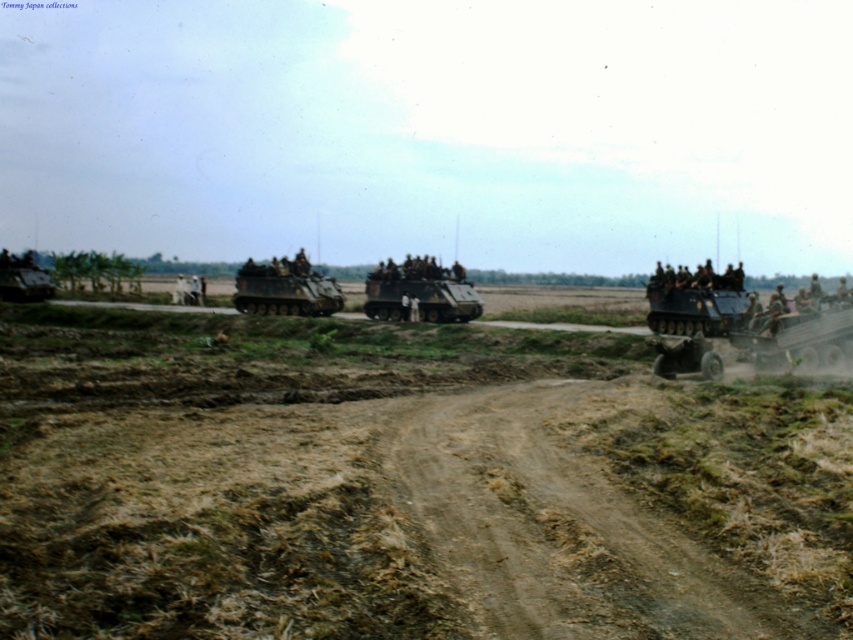
Looking at this image, is matte black armored personnel carrier at right above matte green tank at lower left?

Incorrect, matte black armored personnel carrier at right is not positioned above matte green tank at lower left.

Which of these two, matte black armored personnel carrier at right or matte green tank at lower left, stands taller?

matte black armored personnel carrier at right is taller.

Is point (706, 284) positioned in front of point (53, 282)?

Yes, it is.

Find the location of a particular element. Image resolution: width=853 pixels, height=640 pixels. matte black armored personnel carrier at right is located at coordinates (695, 300).

Is matte black armored personnel carrier at center below matte green tank at center?

Correct, matte black armored personnel carrier at center is located below matte green tank at center.

Does point (422, 292) lie in front of point (337, 285)?

Yes, point (422, 292) is closer to viewer.

Which is behind, point (392, 296) or point (341, 300)?

Positioned behind is point (341, 300).

This screenshot has height=640, width=853. I want to click on matte black armored personnel carrier at center, so click(421, 291).

From the picture: Which of these two, matte black armored personnel carrier at center or matte green tank at lower left, stands taller?

matte green tank at lower left

Which of these two, matte black armored personnel carrier at center or matte green tank at lower left, stands shorter?

matte black armored personnel carrier at center is shorter.

Who is more forward, [425,282] or [21,285]?

Point [425,282] is in front.

Image resolution: width=853 pixels, height=640 pixels. Find the location of `matte black armored personnel carrier at center`. matte black armored personnel carrier at center is located at coordinates (421, 291).